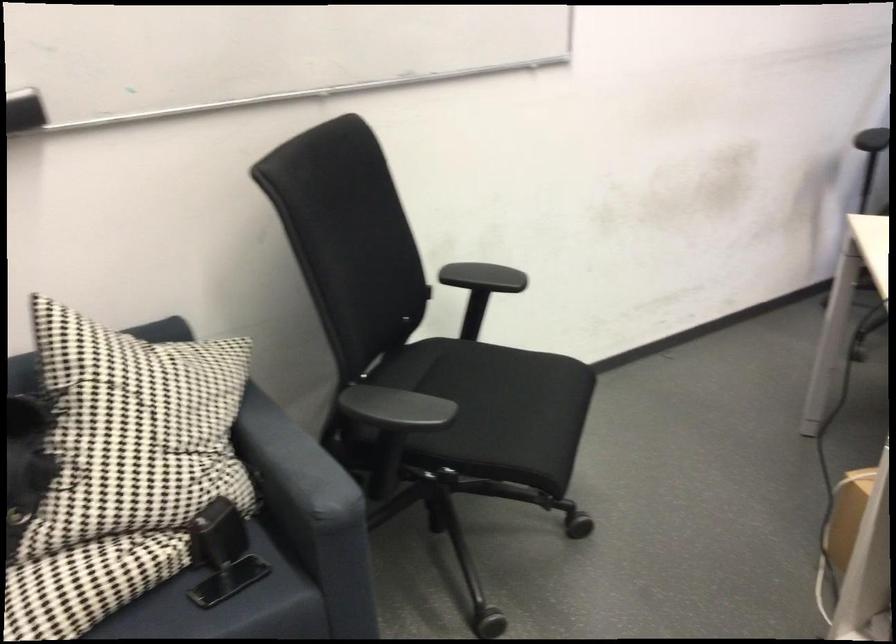
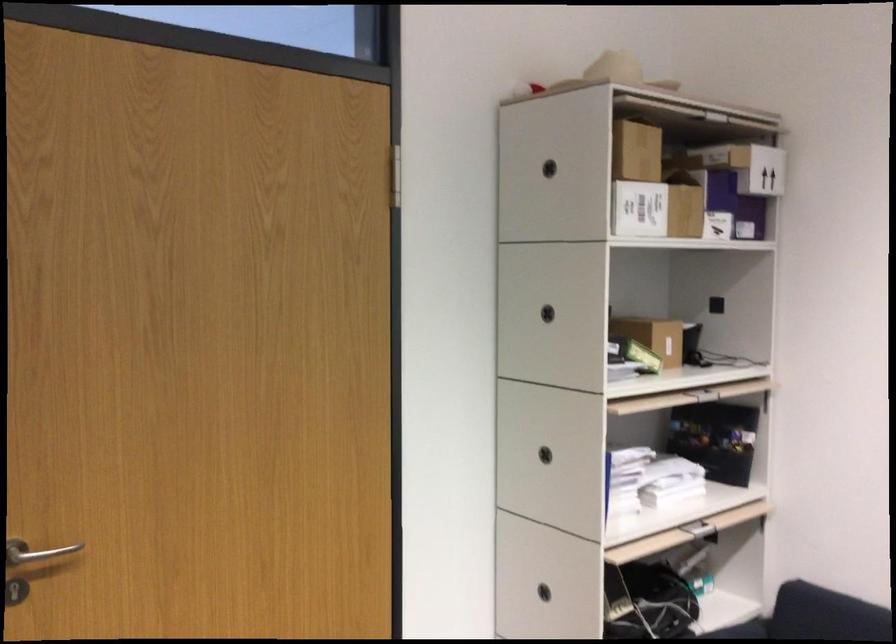
Question: The images are taken continuously from a first-person perspective. In which direction is your viewpoint rotating?

Choices:
 (A) Left
 (B) Right
 (C) Up
 (D) Down

Answer: (A)